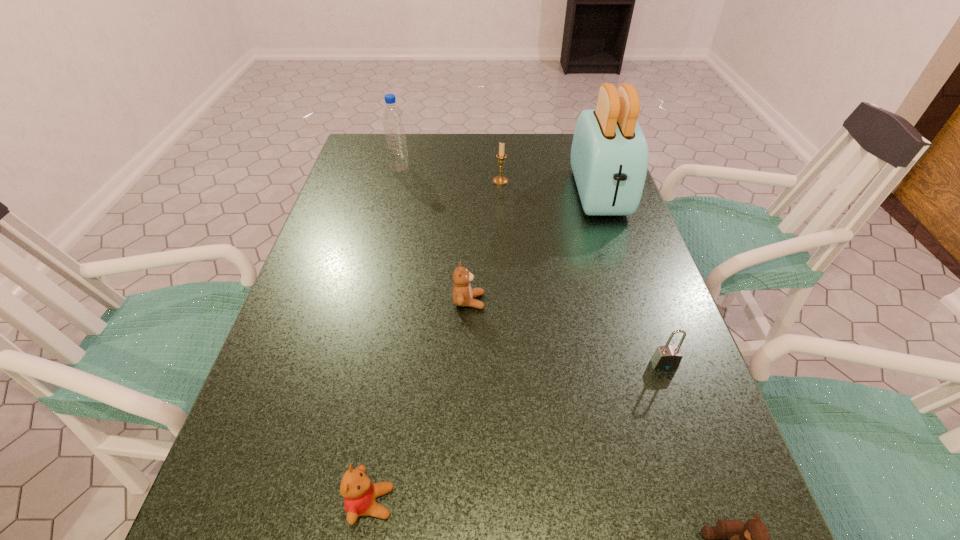
Identify the location of object located in the far left corner section of the desktop. (393, 122).

The height and width of the screenshot is (540, 960). Identify the location of object positioned at the far right corner. (609, 158).

In the image, there is a desktop. Identify the location of free space at the far edge. (414, 135).

The image size is (960, 540). I want to click on free space at the left edge, so click(312, 411).

The height and width of the screenshot is (540, 960). I want to click on vacant space at the right edge, so click(x=638, y=375).

Locate an element on the screen. vacant point located between the third tallest object and the leftmost teddy bear is located at coordinates (436, 342).

Locate an element on the screen. The image size is (960, 540). free space between the fifth farthest object and the water bottle is located at coordinates (532, 266).

This screenshot has height=540, width=960. What are the coordinates of `blank region between the leftmost object and the candle holder` in the screenshot? It's located at (450, 175).

In order to click on free space between the water bottle and the fifth farthest object in this screenshot , I will do `click(532, 266)`.

Locate an element on the screen. The width and height of the screenshot is (960, 540). free space between the second teddy bear from left to right and the toaster is located at coordinates (534, 247).